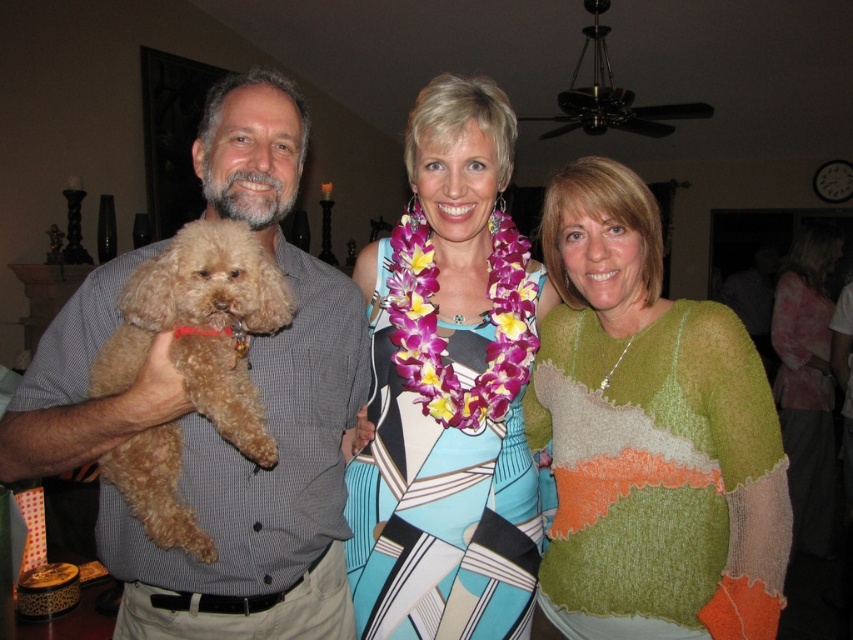
Does knitted green sweater at right have a greater width compared to printed fabric dress at center?

No, knitted green sweater at right is not wider than printed fabric dress at center.

This screenshot has width=853, height=640. What do you see at coordinates (648, 435) in the screenshot?
I see `knitted green sweater at right` at bounding box center [648, 435].

Is point (636, 436) in front of point (479, 410)?

Yes.

Identify the location of knitted green sweater at right. (648, 435).

The image size is (853, 640). Identify the location of printed fabric dress at center. (448, 388).

From the picture: How much distance is there between printed fabric dress at center and light brown fur at center?

printed fabric dress at center and light brown fur at center are 15.37 inches apart.

Is point (486, 100) in front of point (158, 454)?

No, it is behind (158, 454).

Find the location of a particular element. The image size is (853, 640). printed fabric dress at center is located at coordinates (448, 388).

Is point (303, 259) closer to camera compared to point (502, 412)?

No, it is not.

Between point (343, 458) and point (488, 248), which one is positioned in front?

Point (343, 458) is more forward.

Identify the location of matte brown shirt at center. The image size is (853, 640). (210, 422).